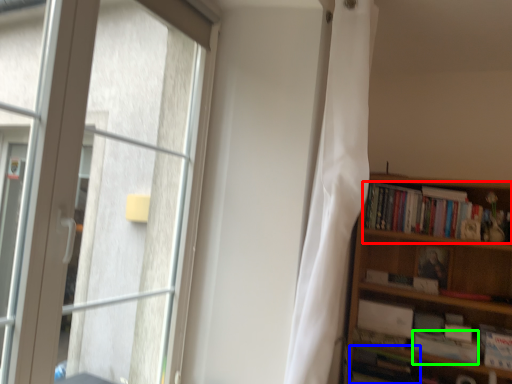
Question: Which object is positioned closest to book (highlighted by a red box)? Select from book (highlighted by a blue box) and paperback book (highlighted by a green box).

Choices:
 (A) book
 (B) paperback book

Answer: (B)